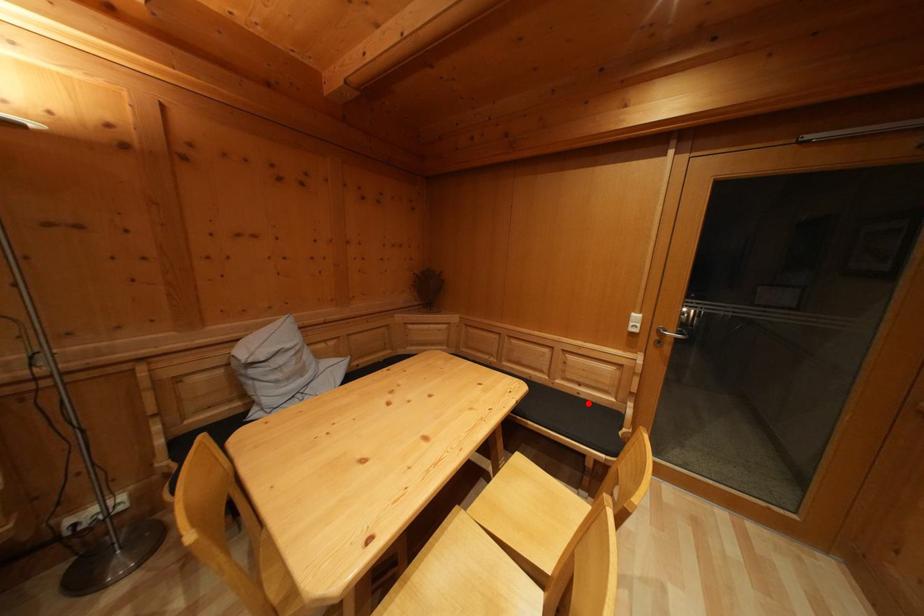
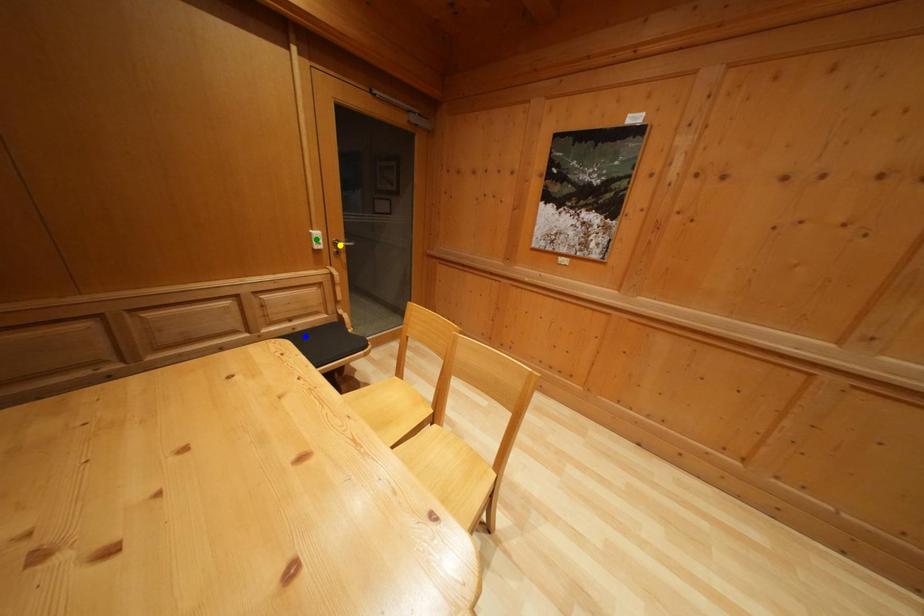
Question: I am providing you with two images of the same scene from different viewpoints. A red point is marked on the first image. You are given multiple points on the second image. Which spot in image 2 lines up with the point in image 1?

Choices:
 (A) yellow point
 (B) blue point
 (C) green point

Answer: (B)